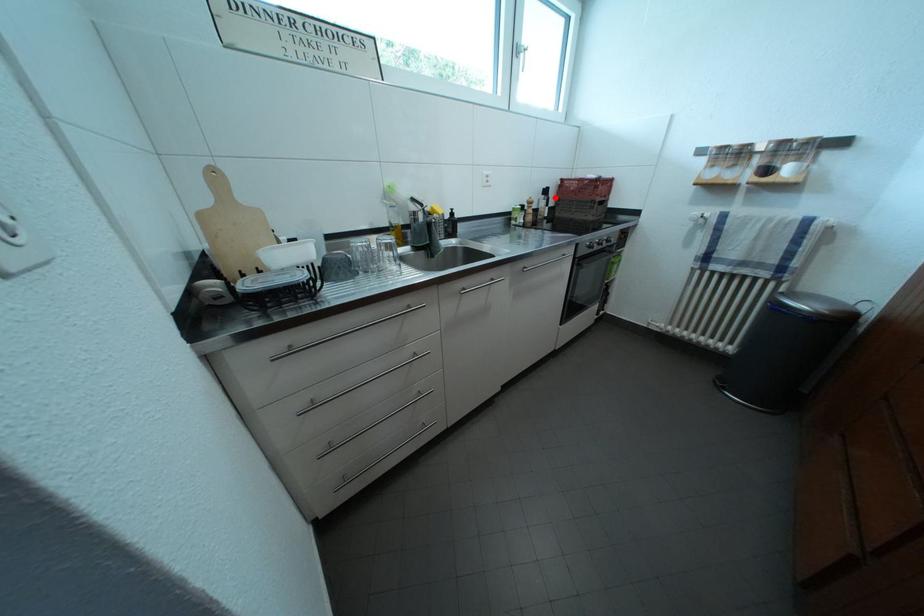
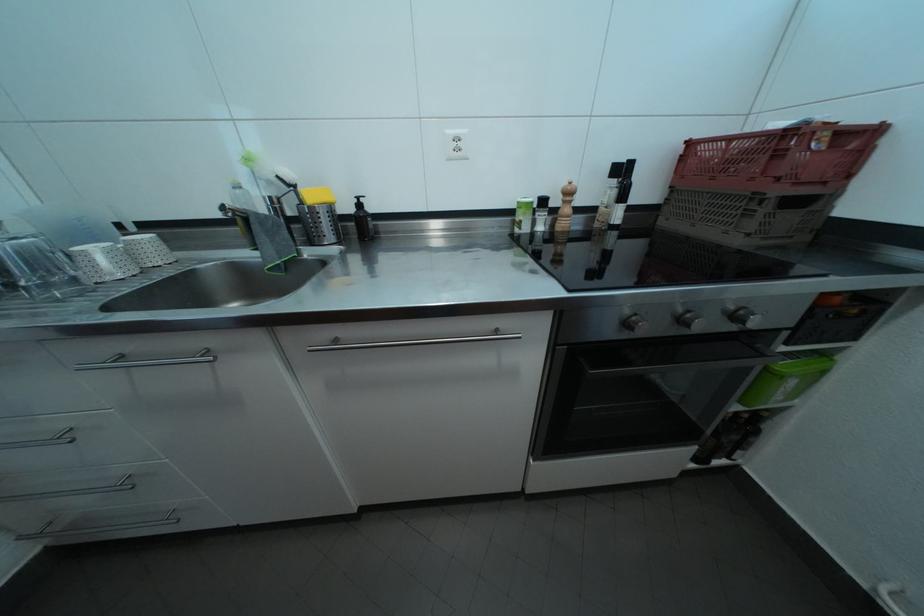
Question: I am providing you with two images of the same scene from different viewpoints. A red point is marked on the first image. Is the red point's position out of view in image 2?

Choices:
 (A) Yes
 (B) No

Answer: (B)